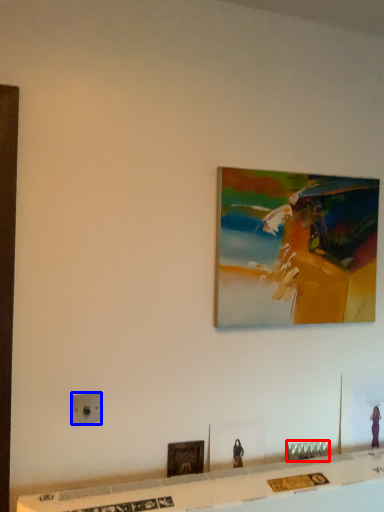
Question: Which object appears closest to the camera in this image, furniture (highlighted by a red box) or electric outlet (highlighted by a blue box)?

Choices:
 (A) furniture
 (B) electric outlet

Answer: (B)